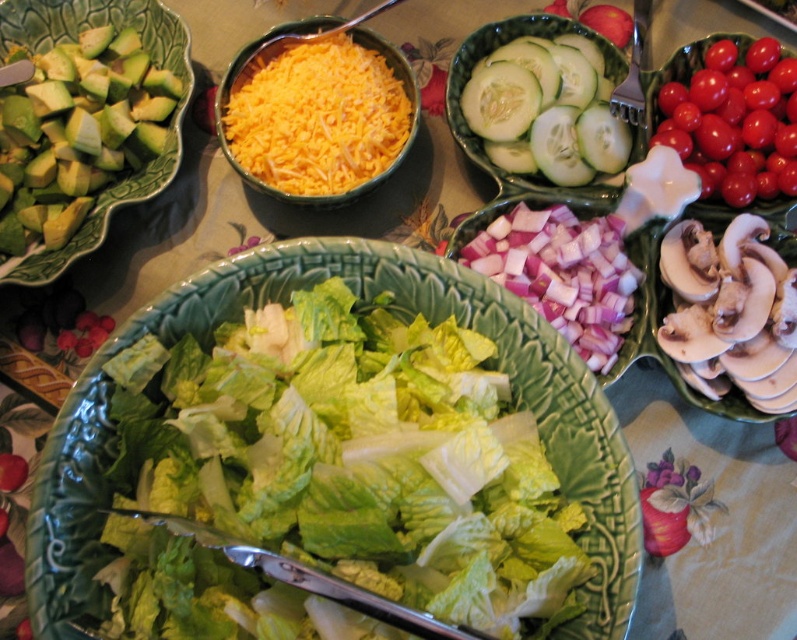
Between pink translucent onion at center and yellow shredded cheese at center, which one has less height?

pink translucent onion at center

Consider the image. Is pink translucent onion at center further to camera compared to yellow shredded cheese at center?

No, it is in front of yellow shredded cheese at center.

Is point (470, 243) more distant than point (301, 22)?

No, it is not.

Find the location of a particular element. pink translucent onion at center is located at coordinates (563, 273).

Is green ceramic bowl at upper left bigger than yellow shredded cheese at center?

Correct, green ceramic bowl at upper left is larger in size than yellow shredded cheese at center.

Between point (50, 13) and point (234, 76), which one is positioned behind?

The point (50, 13) is behind.

Between point (108, 17) and point (324, 26), which one is positioned behind?

The point (108, 17) is more distant.

Find the location of a particular element. The height and width of the screenshot is (640, 797). green ceramic bowl at upper left is located at coordinates (156, 64).

Can you confirm if glossy cherry tomatoes at upper right is positioned to the left of pink translucent onion at center?

In fact, glossy cherry tomatoes at upper right is to the right of pink translucent onion at center.

Who is more distant from viewer, (768, 148) or (540, 253)?

The point (768, 148) is more distant.

Where is `glossy cherry tomatoes at upper right`? Image resolution: width=797 pixels, height=640 pixels. glossy cherry tomatoes at upper right is located at coordinates (729, 116).